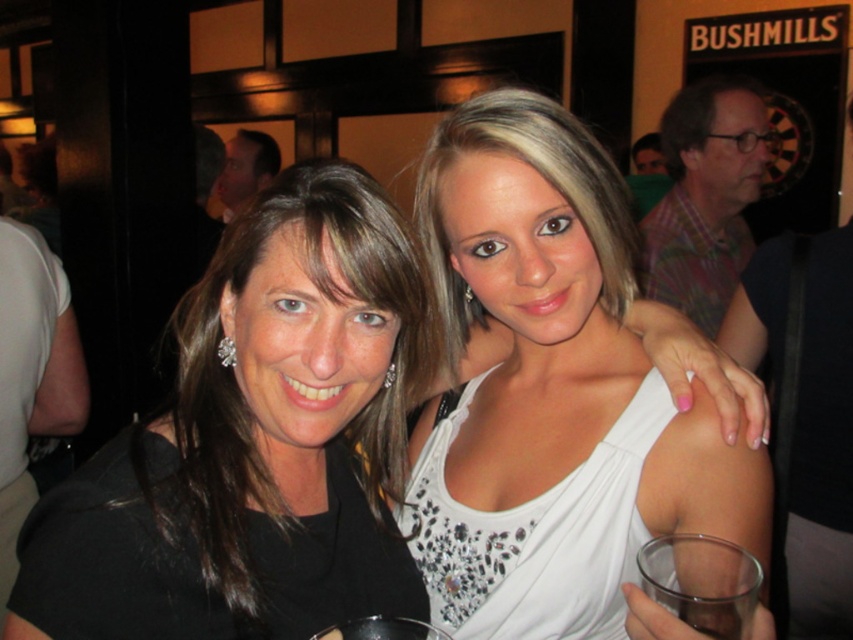
Between plaid shirt at upper right and transparent plastic wine glass at lower center, which one has less height?

transparent plastic wine glass at lower center is shorter.

Where is `plaid shirt at upper right`? The image size is (853, 640). plaid shirt at upper right is located at coordinates [x=705, y=196].

Who is lower down, matte black dress at center or white satin dress at center?

matte black dress at center is below.

Between point (315, 422) and point (604, 470), which one is positioned behind?

The point (604, 470) is more distant.

This screenshot has height=640, width=853. What are the coordinates of `matte black dress at center` in the screenshot? It's located at (256, 444).

Between matte black dress at center and plaid shirt at upper right, which one is positioned higher?

plaid shirt at upper right is above.

Based on the photo, is matte black dress at center below plaid shirt at upper right?

Yes.

Measure the distance between point (62, 570) and camera.

They are 24.32 inches apart.

Find the location of a particular element. matte black dress at center is located at coordinates (256, 444).